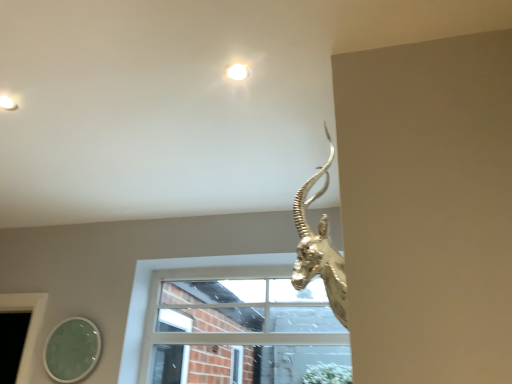
Question: From a real-world perspective, is white glass window at center physically below green glass mirror at lower left?

Choices:
 (A) yes
 (B) no

Answer: (B)

Question: Are white glass window at center and green glass mirror at lower left far apart?

Choices:
 (A) no
 (B) yes

Answer: (A)

Question: Can you confirm if white glass window at center is thinner than green glass mirror at lower left?

Choices:
 (A) yes
 (B) no

Answer: (B)

Question: Is white glass window at center in front of green glass mirror at lower left?

Choices:
 (A) yes
 (B) no

Answer: (A)

Question: Is white glass window at center to the left of green glass mirror at lower left from the viewer's perspective?

Choices:
 (A) yes
 (B) no

Answer: (B)

Question: Would you say gold metallic antelope head at upper right is to the left or to the right of white glass window at center in the picture?

Choices:
 (A) left
 (B) right

Answer: (B)

Question: From the image's perspective, is gold metallic antelope head at upper right positioned above or below white glass window at center?

Choices:
 (A) above
 (B) below

Answer: (A)

Question: Is gold metallic antelope head at upper right bigger or smaller than white glass window at center?

Choices:
 (A) small
 (B) big

Answer: (A)

Question: Is gold metallic antelope head at upper right spatially inside white glass window at center, or outside of it?

Choices:
 (A) inside
 (B) outside

Answer: (B)

Question: Is green glass mirror at lower left wider or thinner than gold metallic antelope head at upper right?

Choices:
 (A) thin
 (B) wide

Answer: (A)

Question: Is green glass mirror at lower left inside or outside of gold metallic antelope head at upper right?

Choices:
 (A) outside
 (B) inside

Answer: (A)

Question: From a real-world perspective, relative to gold metallic antelope head at upper right, is green glass mirror at lower left vertically above or below?

Choices:
 (A) below
 (B) above

Answer: (A)

Question: Based on their sizes in the image, would you say green glass mirror at lower left is bigger or smaller than gold metallic antelope head at upper right?

Choices:
 (A) big
 (B) small

Answer: (B)

Question: Is green glass mirror at lower left taller or shorter than white glass window at center?

Choices:
 (A) tall
 (B) short

Answer: (B)

Question: Is green glass mirror at lower left bigger or smaller than white glass window at center?

Choices:
 (A) big
 (B) small

Answer: (B)